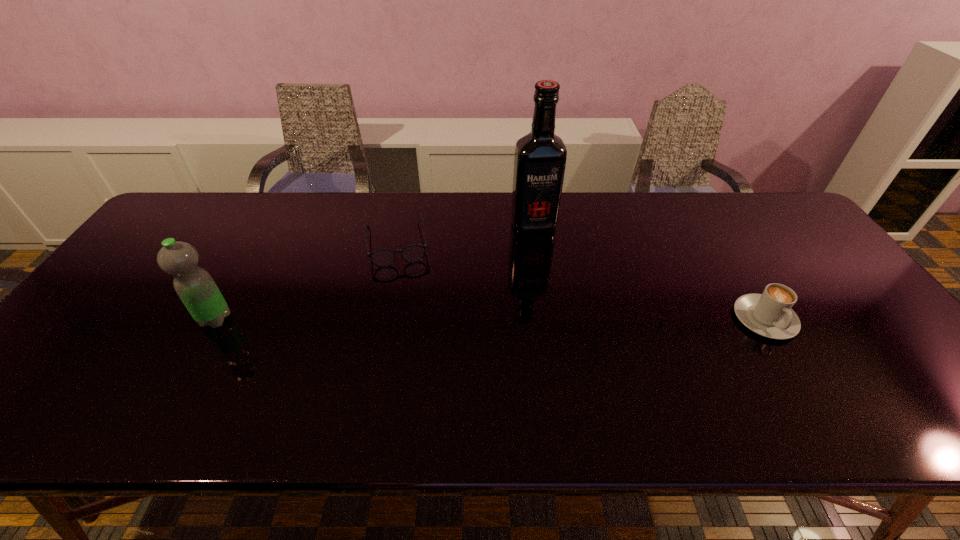
Where is `free region at the left edge`? free region at the left edge is located at coordinates (118, 301).

The image size is (960, 540). I want to click on vacant region at the right edge, so click(x=848, y=303).

At what (x,y) coordinates should I click in order to perform the action: click on vacant position at the far left corner of the desktop. Please return your answer as a coordinate pair (x, y). The width and height of the screenshot is (960, 540). Looking at the image, I should click on coord(198,197).

The height and width of the screenshot is (540, 960). I want to click on blank space at the far right corner, so click(x=747, y=194).

What are the coordinates of `free space between the third shortest object and the third object from right to left` in the screenshot? It's located at (306, 281).

The image size is (960, 540). Find the location of `free space that is in between the liquor and the second tallest object`. free space that is in between the liquor and the second tallest object is located at coordinates (374, 272).

I want to click on free space between the third tallest object and the spectacles, so click(x=581, y=281).

Find the location of a particular element. Image resolution: width=960 pixels, height=540 pixels. free space between the liquor and the third shortest object is located at coordinates (374, 272).

I want to click on empty space that is in between the spectacles and the third tallest object, so click(x=581, y=281).

Identify the location of empty space between the cappuccino and the spectacles. (581, 281).